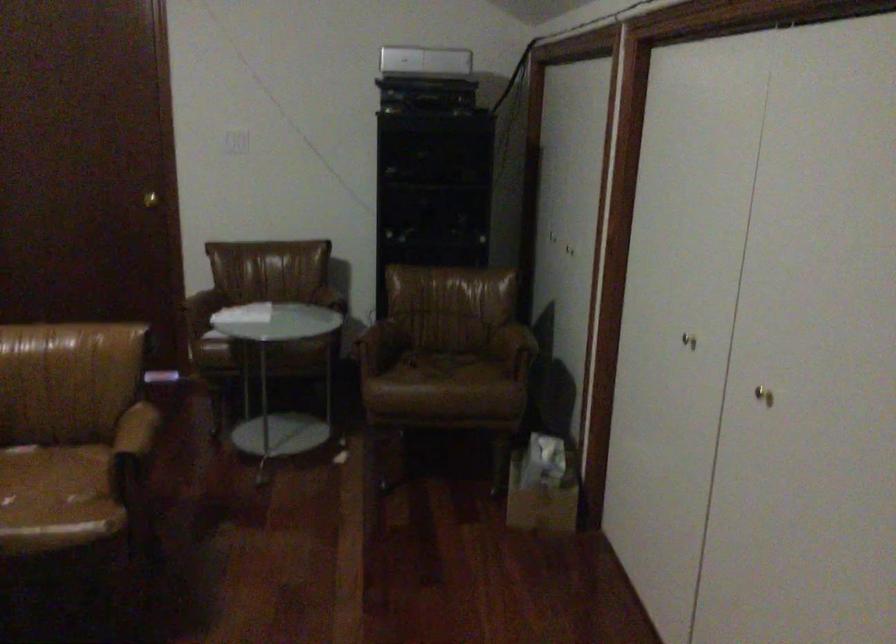
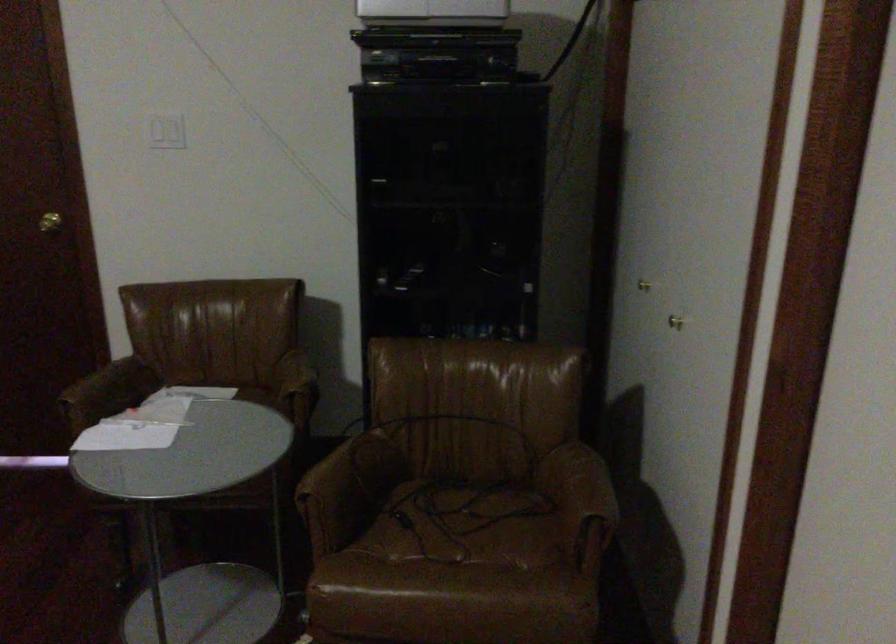
Locate, in the second image, the point that corresponds to (x=515, y=337) in the first image.

(582, 485)